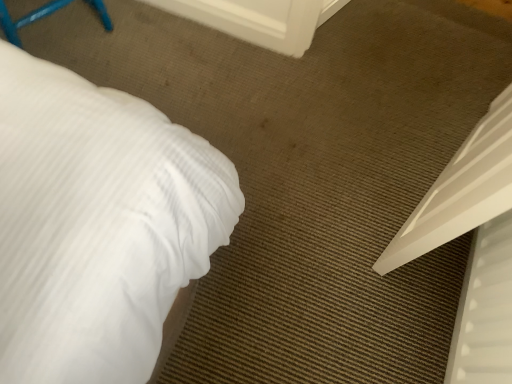
Where is `white plastic screen door at upper center`? The height and width of the screenshot is (384, 512). white plastic screen door at upper center is located at coordinates (254, 20).

What is the approximate height of white plastic screen door at upper center?

white plastic screen door at upper center is 4.47 inches tall.

Describe the element at coordinates (254, 20) in the screenshot. I see `white plastic screen door at upper center` at that location.

The image size is (512, 384). Describe the element at coordinates (472, 245) in the screenshot. I see `white plastic bed at lower right` at that location.

Locate an element on the screen. The width and height of the screenshot is (512, 384). white plastic bed at lower right is located at coordinates (472, 245).

You are a GUI agent. You are given a task and a screenshot of the screen. Output one action in this format:
    pyautogui.click(x=<x>, y=<y>)
    Task: Click on the white plastic screen door at upper center
    
    Given the screenshot: What is the action you would take?
    pyautogui.click(x=254, y=20)

Considering the positions of objects white plastic screen door at upper center and white plastic bed at lower right in the image provided, who is more to the right, white plastic screen door at upper center or white plastic bed at lower right?

white plastic bed at lower right.

Does white plastic screen door at upper center lie behind white plastic bed at lower right?

Yes, the depth of white plastic screen door at upper center is greater than that of white plastic bed at lower right.

Does point (240, 14) come farther from viewer compared to point (474, 339)?

Yes, point (240, 14) is farther from viewer.

Based on the photo, from the image's perspective, is white plastic screen door at upper center located beneath white plastic bed at lower right?

Incorrect, from the image's perspective, white plastic screen door at upper center is higher than white plastic bed at lower right.

Consider the image. From a real-world perspective, relative to white plastic bed at lower right, is white plastic screen door at upper center vertically above or below?

In terms of real-world spatial position, white plastic screen door at upper center is below white plastic bed at lower right.

Can you confirm if white plastic screen door at upper center is wider than white plastic bed at lower right?

Incorrect, the width of white plastic screen door at upper center does not surpass that of white plastic bed at lower right.

Between white plastic screen door at upper center and white plastic bed at lower right, which one has less height?

A: Standing shorter between the two is white plastic screen door at upper center.

Considering the sizes of objects white plastic screen door at upper center and white plastic bed at lower right in the image provided, who is bigger, white plastic screen door at upper center or white plastic bed at lower right?

Bigger between the two is white plastic bed at lower right.

Is white plastic screen door at upper center not inside white plastic bed at lower right?

Indeed, white plastic screen door at upper center is completely outside white plastic bed at lower right.

Is white plastic screen door at upper center in contact with white plastic bed at lower right?

No, white plastic screen door at upper center is not next to white plastic bed at lower right.

Is white plastic screen door at upper center oriented away from white plastic bed at lower right?

white plastic screen door at upper center is not turned away from white plastic bed at lower right.

How many degrees apart are the facing directions of white plastic screen door at upper center and white plastic bed at lower right?

There is a 109-degree angle between the facing directions of white plastic screen door at upper center and white plastic bed at lower right.

This screenshot has width=512, height=384. Identify the location of bed below the white plastic screen door at upper center (from the image's perspective). pos(472,245).

Which is more to the right, white plastic bed at lower right or white plastic screen door at upper center?

white plastic bed at lower right.

Is white plastic bed at lower right further to camera compared to white plastic screen door at upper center?

No, white plastic bed at lower right is in front of white plastic screen door at upper center.

Considering the positions of points (395, 248) and (297, 41), is point (395, 248) closer to camera compared to point (297, 41)?

Yes, point (395, 248) is closer to viewer.

From the image's perspective, between white plastic bed at lower right and white plastic screen door at upper center, who is located below?

From the image's view, white plastic bed at lower right is below.

From a real-world perspective, is white plastic bed at lower right above or below white plastic screen door at upper center?

white plastic bed at lower right is above white plastic screen door at upper center.

Between white plastic bed at lower right and white plastic screen door at upper center, which one has smaller width?

Thinner between the two is white plastic screen door at upper center.

Does white plastic bed at lower right have a greater height compared to white plastic screen door at upper center?

Yes.

Who is smaller, white plastic bed at lower right or white plastic screen door at upper center?

white plastic screen door at upper center.

Is white plastic bed at lower right outside of white plastic screen door at upper center?

Yes, white plastic bed at lower right is not within white plastic screen door at upper center.

Is white plastic bed at lower right next to white plastic screen door at upper center and touching it?

No, white plastic bed at lower right is not making contact with white plastic screen door at upper center.

Looking at this image, is white plastic bed at lower right oriented away from white plastic screen door at upper center?

That's not correct — white plastic bed at lower right is not looking away from white plastic screen door at upper center.

What's the angular difference between white plastic bed at lower right and white plastic screen door at upper center's facing directions?

The angular difference between white plastic bed at lower right and white plastic screen door at upper center is 109 degrees.

The height and width of the screenshot is (384, 512). Identify the location of screen door below the white plastic bed at lower right (from a real-world perspective). point(254,20).

This screenshot has height=384, width=512. Find the location of `screen door located above the white plastic bed at lower right (from the image's perspective)`. screen door located above the white plastic bed at lower right (from the image's perspective) is located at coordinates (254, 20).

Find the location of `screen door below the white plastic bed at lower right (from a real-world perspective)`. screen door below the white plastic bed at lower right (from a real-world perspective) is located at coordinates (254, 20).